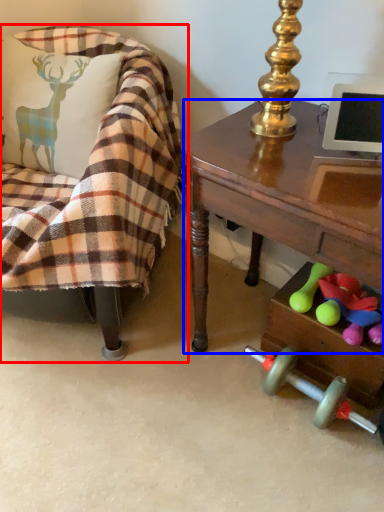
Question: Which object appears closest to the camera in this image, chair (highlighted by a red box) or desk (highlighted by a blue box)?

Choices:
 (A) chair
 (B) desk

Answer: (B)